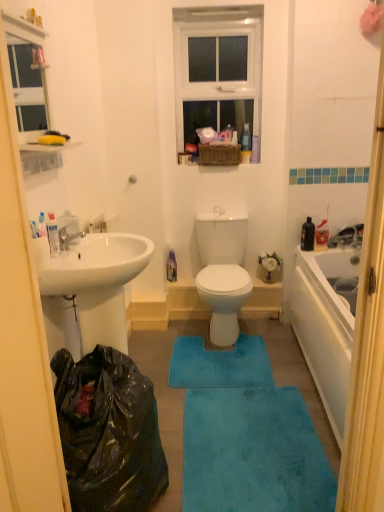
The width and height of the screenshot is (384, 512). I want to click on free spot above blue plush bath mat at center, the 1th bath mat when ordered from bottom to top (from a real-world perspective), so click(240, 435).